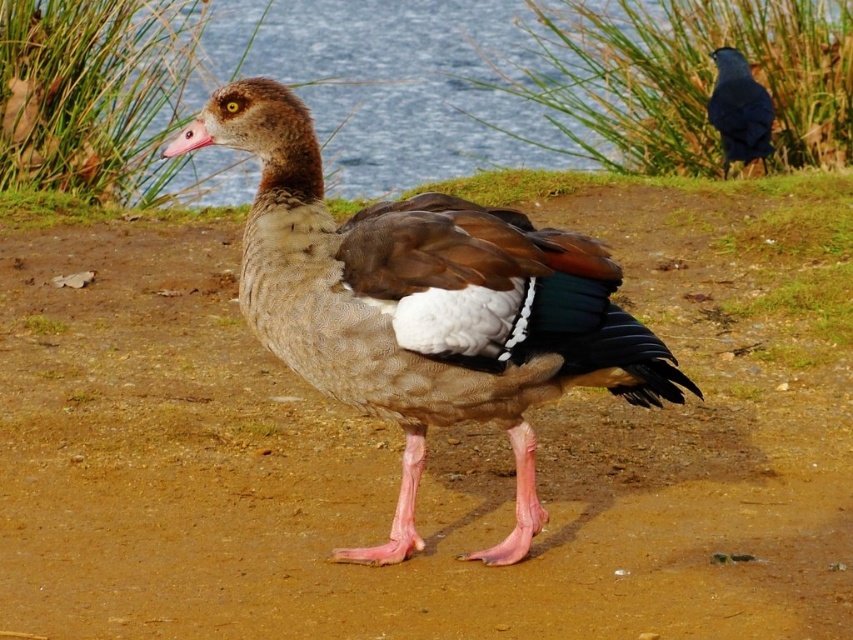
Does brown feathered duck at center have a smaller size compared to shiny blue bird at upper right?

Actually, brown feathered duck at center might be larger than shiny blue bird at upper right.

From the picture: Does brown feathered duck at center appear on the right side of shiny blue bird at upper right?

In fact, brown feathered duck at center is to the left of shiny blue bird at upper right.

Does point (624, 356) lie in front of point (763, 122)?

Yes, it is.

The image size is (853, 640). Find the location of `brown feathered duck at center`. brown feathered duck at center is located at coordinates (426, 308).

I want to click on brown dirt field at center, so click(x=428, y=440).

I want to click on brown dirt field at center, so click(428, 440).

From the picture: Between brown dirt field at center and brown feathered duck at center, which one is positioned lower?

brown feathered duck at center is lower down.

Who is more distant from viewer, (x=633, y=410) or (x=578, y=356)?

Point (x=633, y=410)

Is point (338, 502) in front of point (486, 404)?

No, it is behind (486, 404).

This screenshot has height=640, width=853. I want to click on brown dirt field at center, so click(428, 440).